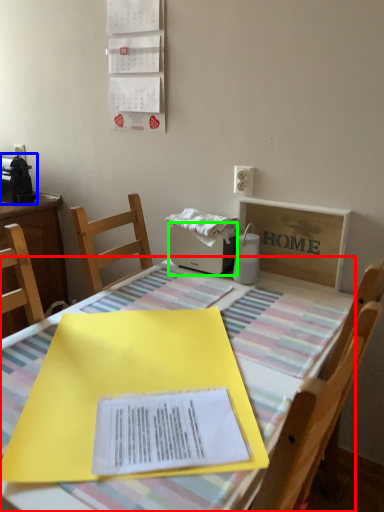
Question: Which is nearer to the table (highlighted by a red box)? appliance (highlighted by a blue box) or appliance (highlighted by a green box).

Choices:
 (A) appliance
 (B) appliance

Answer: (B)